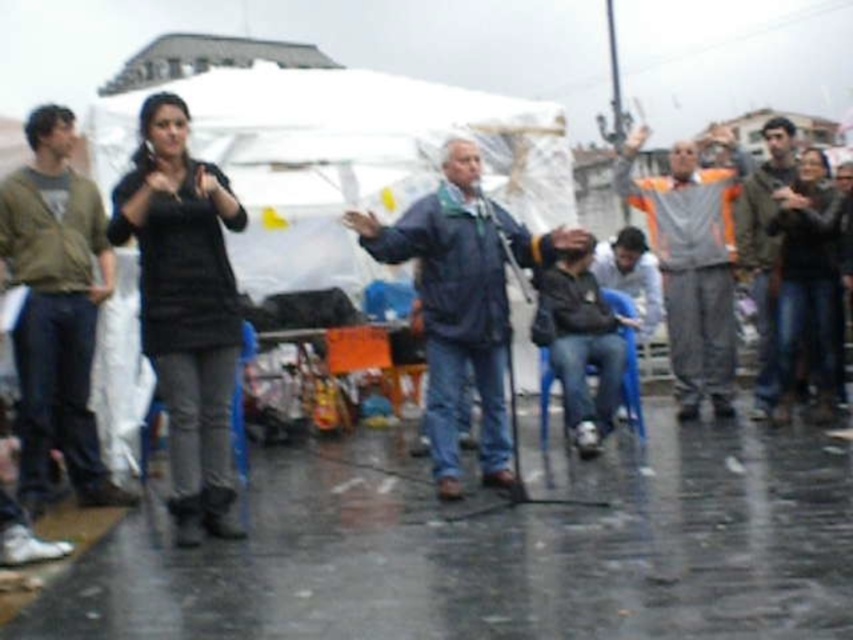
Question: Which object is closer to the camera taking this photo?

Choices:
 (A) blue plastic chair at lower center
 (B) blue plastic chair at center

Answer: (A)

Question: Does blue plastic chair at lower center have a smaller size compared to blue plastic chair at center?

Choices:
 (A) yes
 (B) no

Answer: (A)

Question: Which of the following is the closest to the observer?

Choices:
 (A) blue denim jacket at center
 (B) black matte shirt at upper left
 (C) greenish-gray jacket at right
 (D) black matte jacket at upper right

Answer: (B)

Question: Does orange reflective vest at center appear over blue plastic chair at center?

Choices:
 (A) yes
 (B) no

Answer: (A)

Question: Which object is the farthest from the black matte shirt at upper left?

Choices:
 (A) blue plastic chair at center
 (B) blue denim jacket at center

Answer: (A)

Question: Does blue denim jacket at center appear on the right side of blue plastic chair at center?

Choices:
 (A) no
 (B) yes

Answer: (A)